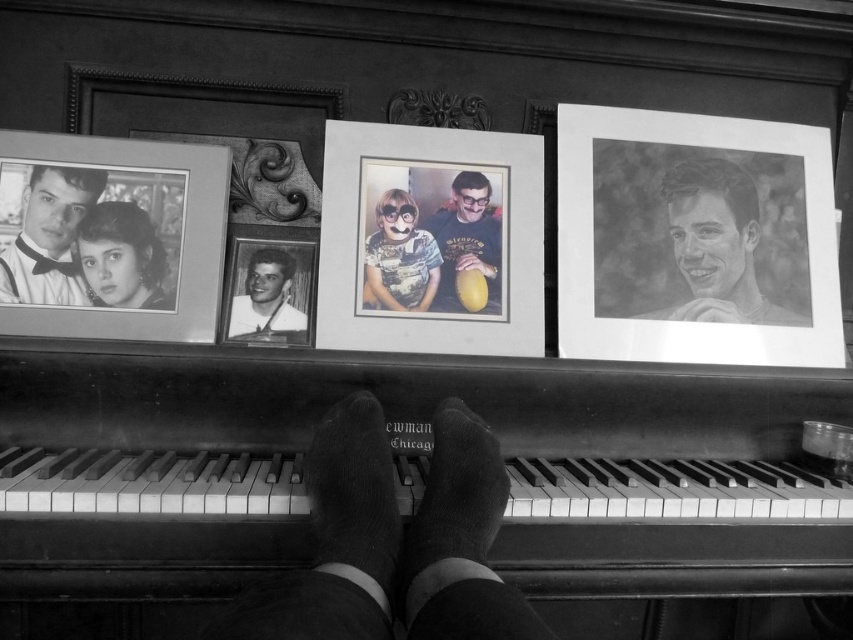
Can you confirm if socks at center is smaller than matte black photo frame at left?

Actually, socks at center might be larger than matte black photo frame at left.

Who is more distant from viewer, (x=294, y=614) or (x=44, y=275)?

The point (x=44, y=275) is more distant.

At what (x,y) coordinates should I click in order to perform the action: click on socks at center. Please return your answer as a coordinate pair (x, y). Image resolution: width=853 pixels, height=640 pixels. Looking at the image, I should click on (393, 541).

Who is taller, smooth paper portrait at right or matte black photo frame at left?

smooth paper portrait at right is taller.

Is smooth paper portrait at right positioned before matte black photo frame at left?

That is False.

You are a GUI agent. You are given a task and a screenshot of the screen. Output one action in this format:
    pyautogui.click(x=<x>, y=<y>)
    Task: Click on the smooth paper portrait at right
    The width and height of the screenshot is (853, 640).
    Given the screenshot: What is the action you would take?
    pyautogui.click(x=695, y=240)

Between socks at center and matte black bow tie at left, which one appears on the right side from the viewer's perspective?

socks at center is more to the right.

Can you confirm if socks at center is positioned above matte black bow tie at left?

No, socks at center is not above matte black bow tie at left.

This screenshot has height=640, width=853. What do you see at coordinates (393, 541) in the screenshot?
I see `socks at center` at bounding box center [393, 541].

Image resolution: width=853 pixels, height=640 pixels. What are the coordinates of `socks at center` in the screenshot? It's located at (393, 541).